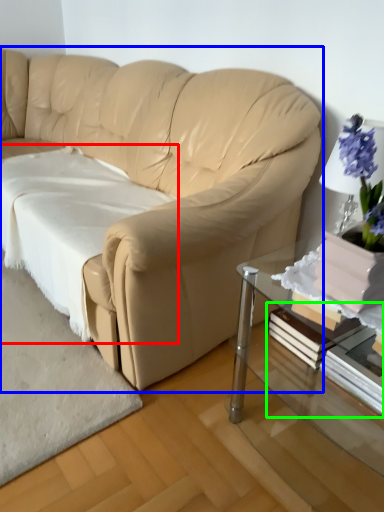
Question: Based on their relative distances, which object is farther from sheet (highlighted by a red box)? Choose from studio couch (highlighted by a blue box) and book (highlighted by a green box).

Choices:
 (A) studio couch
 (B) book

Answer: (B)